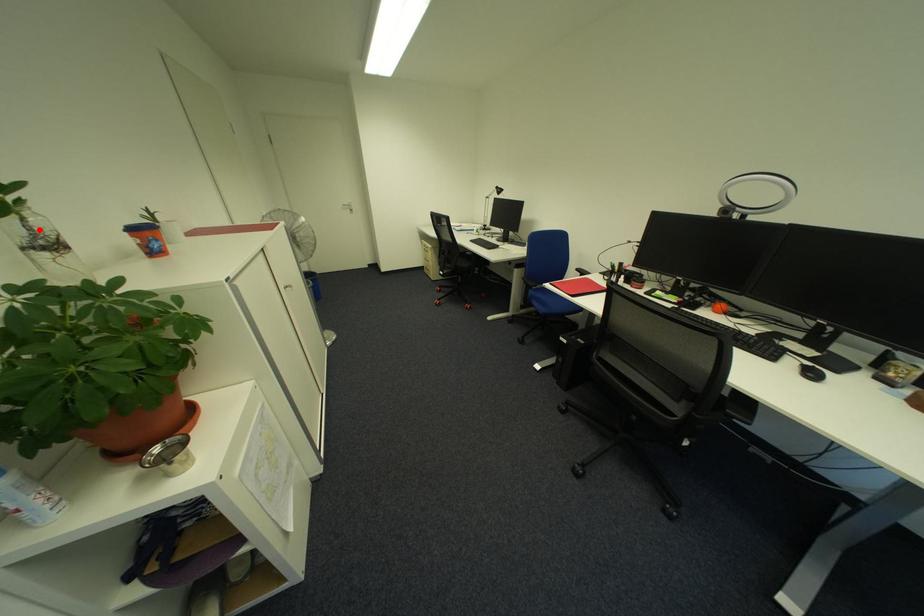
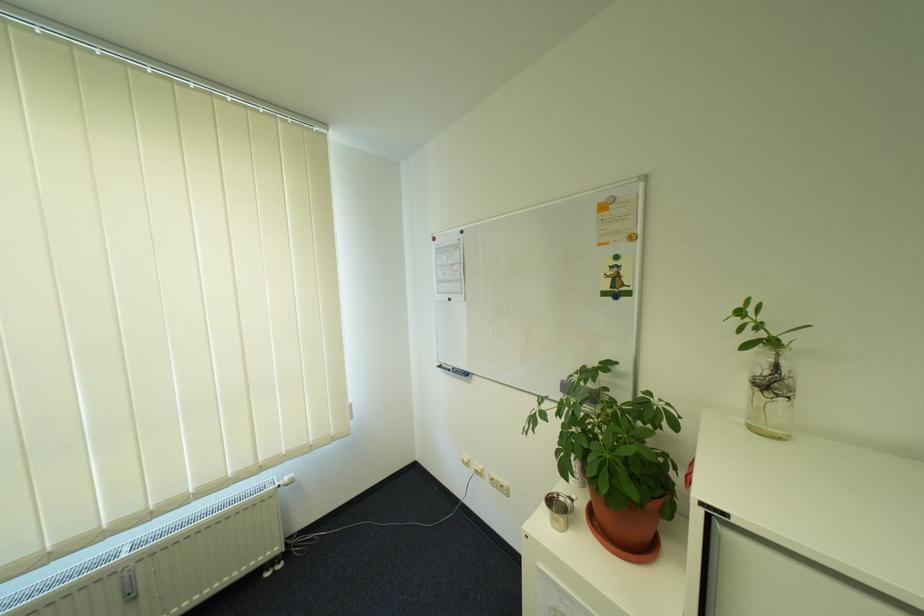
Find the pixel in the second image that matches the highlighted location in the first image.

(785, 369)